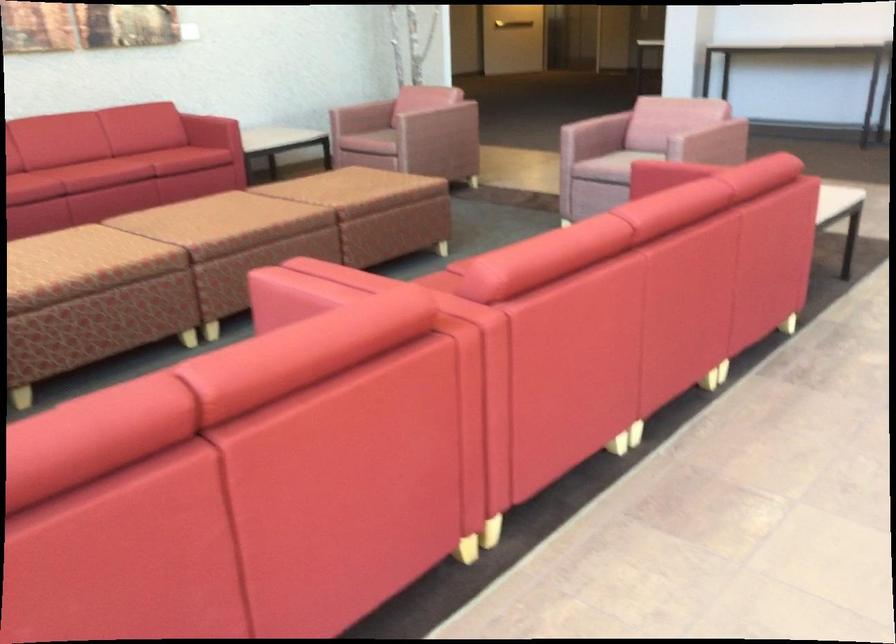
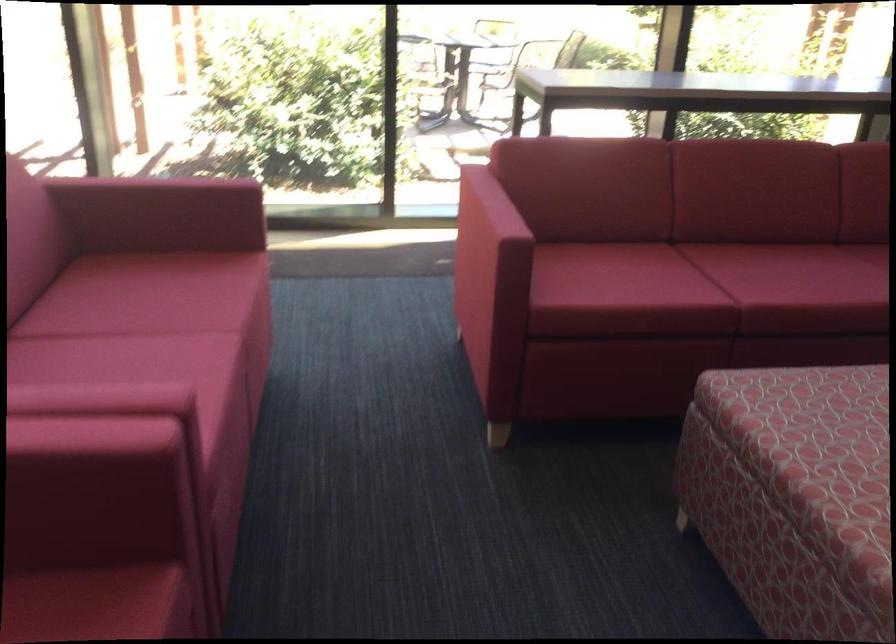
Find the pixel in the second image that matches (x=83, y=267) in the first image.

(815, 460)